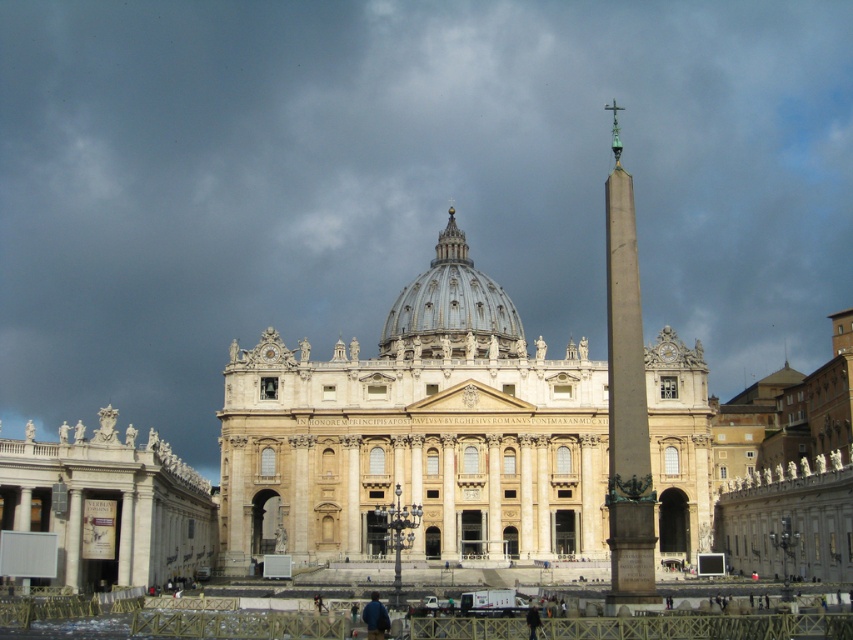
Consider the image. Can you confirm if light beige stone palace at center is positioned below white marble statues at left?

No.

Between point (595, 364) and point (90, 547), which one is positioned behind?

The point (595, 364) is more distant.

Identify the location of light beige stone palace at center. The image size is (853, 640). (416, 435).

Who is positioned more to the right, polished bronze obelisk at right or white marble dome at center?

From the viewer's perspective, polished bronze obelisk at right appears more on the right side.

Where is `polished bronze obelisk at right`? The image size is (853, 640). polished bronze obelisk at right is located at coordinates (625, 403).

Find the location of a particular element. polished bronze obelisk at right is located at coordinates (625, 403).

Is the position of light beige stone palace at center less distant than that of polished bronze obelisk at right?

No, light beige stone palace at center is further to the viewer.

Who is lower down, light beige stone palace at center or polished bronze obelisk at right?

light beige stone palace at center is lower down.

Describe the element at coordinates (416, 435) in the screenshot. Image resolution: width=853 pixels, height=640 pixels. I see `light beige stone palace at center` at that location.

The height and width of the screenshot is (640, 853). I want to click on light beige stone palace at center, so (416, 435).